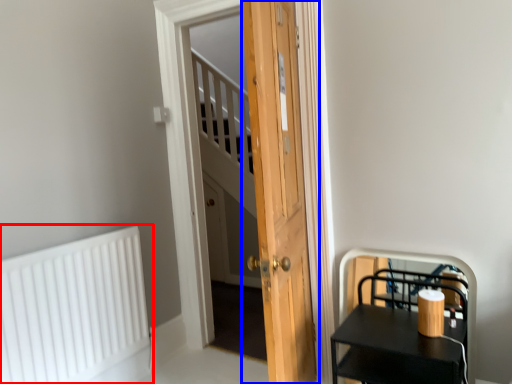
Question: Which object appears farthest to the camera in this image, radiator (highlighted by a red box) or door (highlighted by a blue box)?

Choices:
 (A) radiator
 (B) door

Answer: (A)